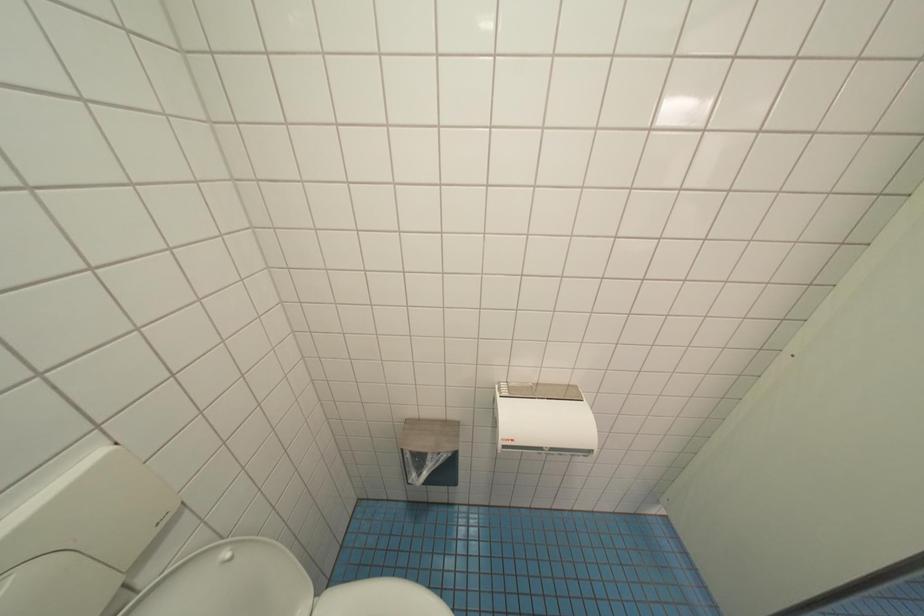
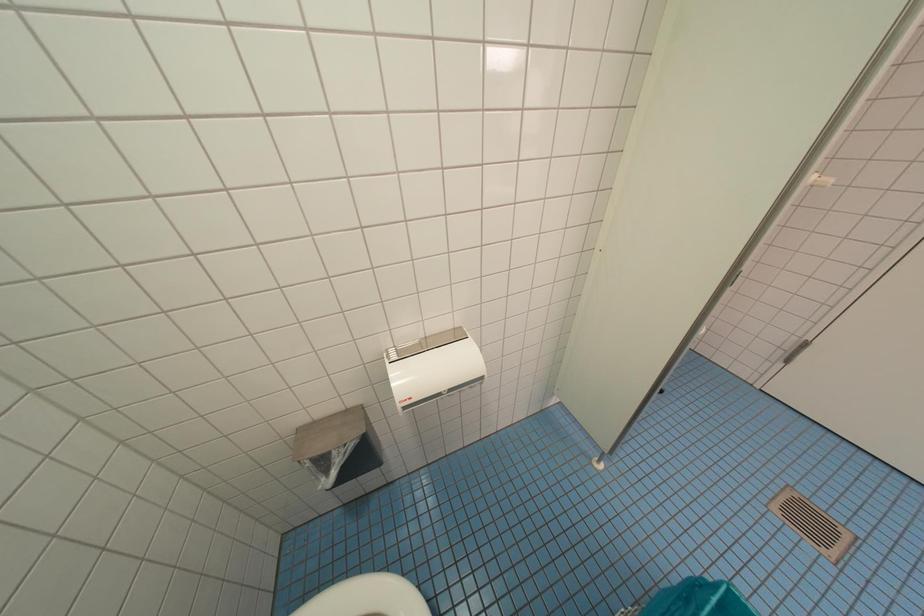
Question: Based on the continuous images, in which direction is the camera rotating? Reply with the corresponding letter.

Choices:
 (A) Left
 (B) Right
 (C) Up
 (D) Down

Answer: (B)